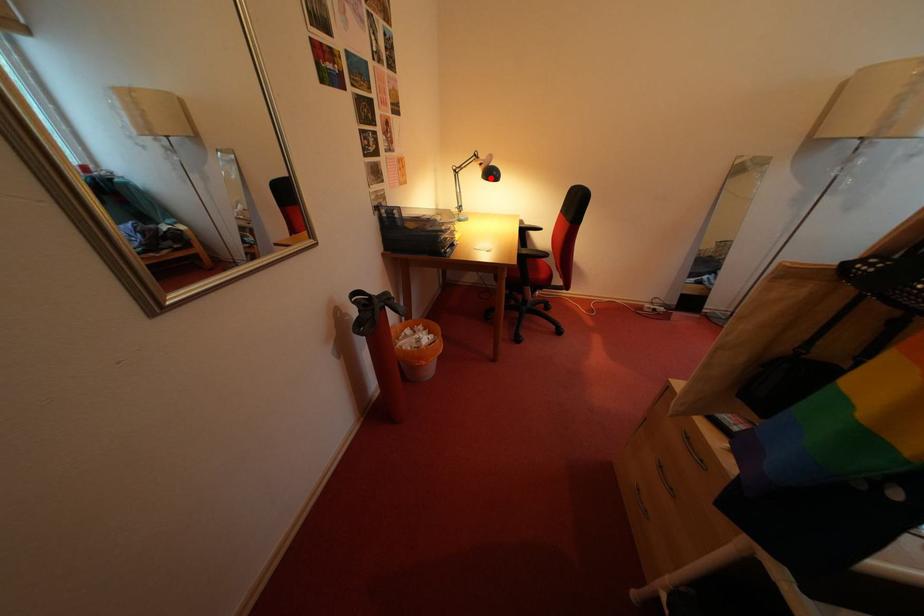
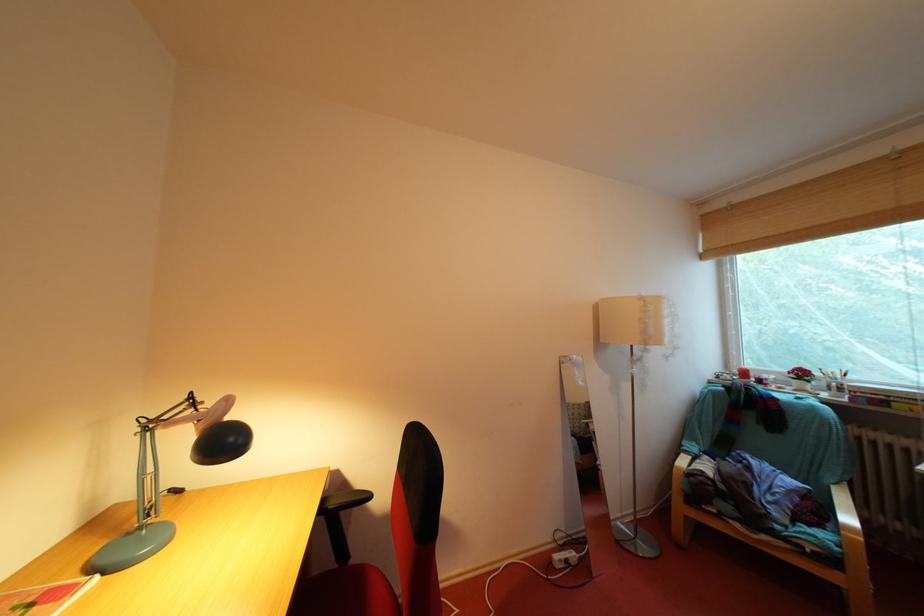
The point at the highlighted location is marked in the first image. Where is the corresponding point in the second image?

(204, 446)